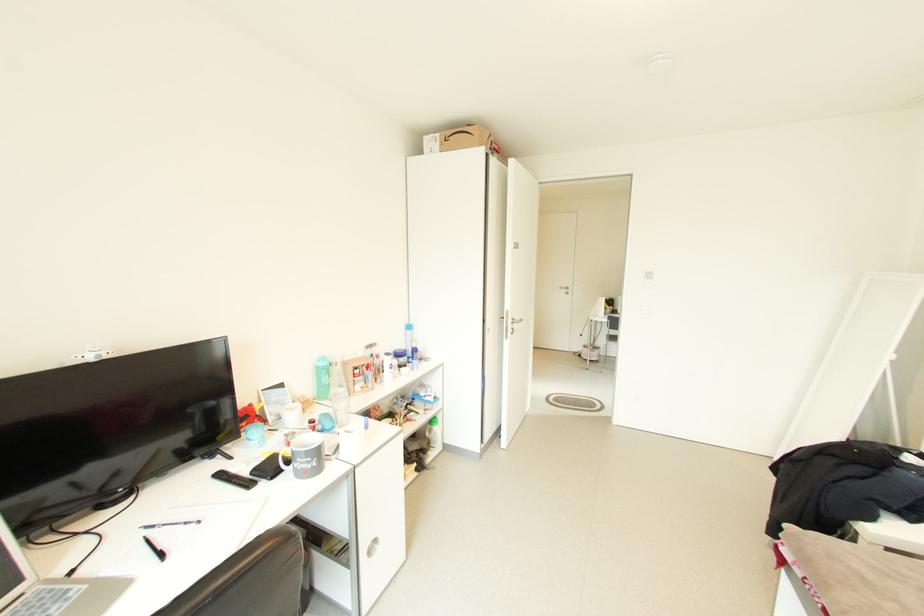
The height and width of the screenshot is (616, 924). In order to click on grey mug handle in this screenshot , I will do `click(285, 459)`.